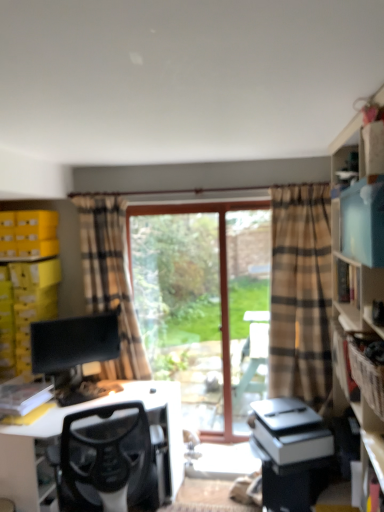
Find the location of a particular element. vacant point above white plastic printer at center (from a real-world perspective) is located at coordinates (279, 411).